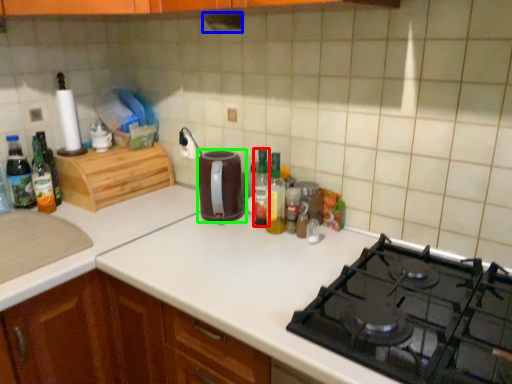
Question: Considering the real-world distances, which object is farthest from bottle (highlighted by a red box)? exhaust hood (highlighted by a blue box) or kitchen appliance (highlighted by a green box)?

Choices:
 (A) exhaust hood
 (B) kitchen appliance

Answer: (A)